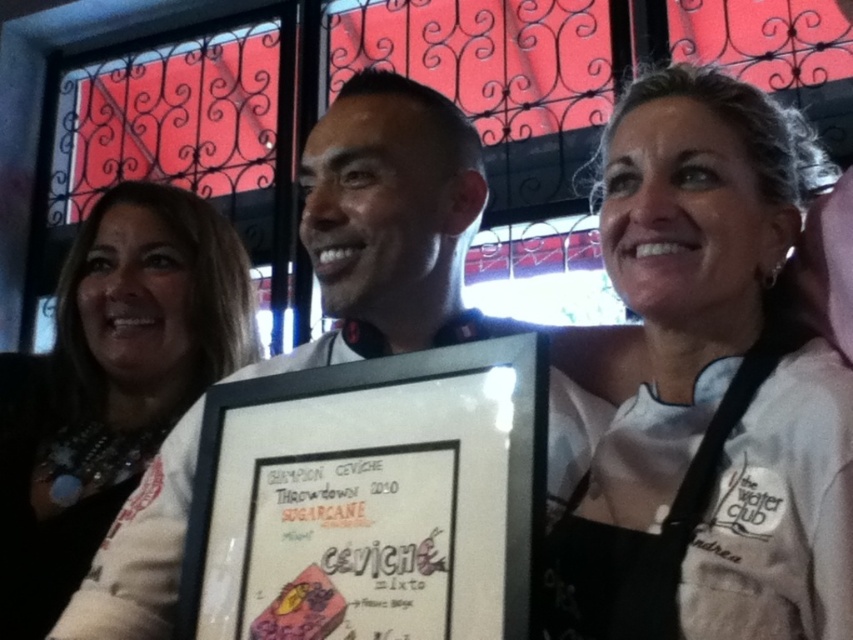
Based on the photo, you are a photographer at a certification ceremony. You need to ensure the matte white frame at center and the white fabric at center are both visible in your photo. Based on their positions, which object should appear closer to the camera?

The matte white frame at center is in front of the white fabric at center, so the matte white frame at center will appear closer to the camera.

You are a photographer who needs to adjust the lighting between the matte paper certificate at center and the white fabric at center. Since the certificate is closer to the camera, you want to ensure both are evenly lit. Given their distance apart, what adjustment should you make?

The matte paper certificate at center is 22.79 inches away from the white fabric at center. To evenly light both, you should increase the light intensity on the white fabric at center since it is farther from the camera and might be underexposed compared to the closer certificate.